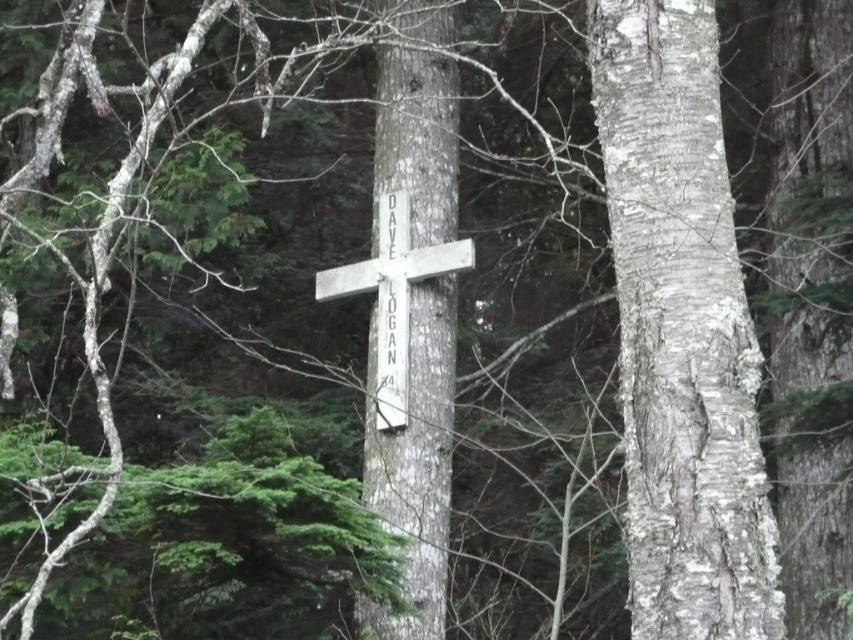
You are a hiker who has just found a wooden cross in the forest. You notice there are two objects here. One is a smooth bark tree trunk at center, and the other is a white rough bark cross at center. According to the scene, which object is located to the left of the other?

The smooth bark tree trunk at center is positioned on the right side of white rough bark cross at center, so the white rough bark cross at center is to the left of the smooth bark tree trunk at center.